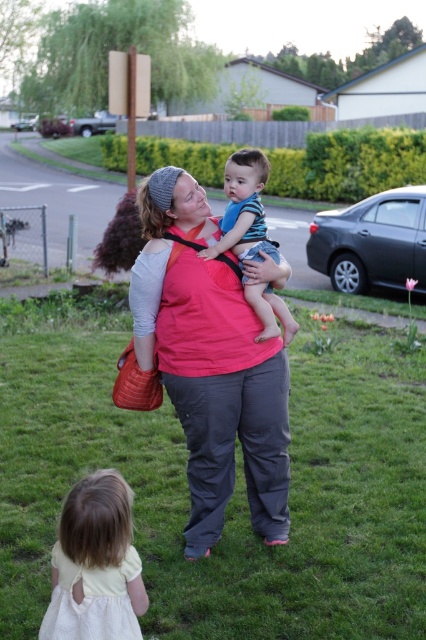
Question: Does matte pink shirt at center lie behind white cotton dress at lower left?

Choices:
 (A) yes
 (B) no

Answer: (A)

Question: Is matte pink shirt at center smaller than blue striped shirt at center?

Choices:
 (A) yes
 (B) no

Answer: (B)

Question: Does green grass at lower center have a smaller size compared to matte pink shirt at center?

Choices:
 (A) no
 (B) yes

Answer: (B)

Question: Which of the following is the closest to the observer?

Choices:
 (A) white cotton dress at lower left
 (B) matte pink shirt at center

Answer: (A)

Question: Which of the following is the closest to the observer?

Choices:
 (A) blue striped shirt at center
 (B) matte pink shirt at center
 (C) white cotton dress at lower left
 (D) green grass at lower center

Answer: (C)

Question: Which object appears closest to the camera in this image?

Choices:
 (A) blue striped shirt at center
 (B) green grass at lower center
 (C) matte pink shirt at center
 (D) white cotton dress at lower left

Answer: (D)